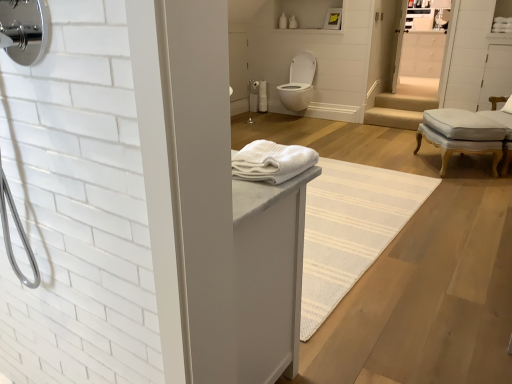
Question: Is matte white shower at center taller than light gray fabric ottoman at right?

Choices:
 (A) yes
 (B) no

Answer: (A)

Question: Can you confirm if matte white shower at center is wider than light gray fabric ottoman at right?

Choices:
 (A) no
 (B) yes

Answer: (A)

Question: From the image's perspective, is matte white shower at center on light gray fabric ottoman at right?

Choices:
 (A) no
 (B) yes

Answer: (B)

Question: Is matte white shower at center at the right side of light gray fabric ottoman at right?

Choices:
 (A) no
 (B) yes

Answer: (A)

Question: Considering the relative sizes of matte white shower at center and light gray fabric ottoman at right in the image provided, is matte white shower at center shorter than light gray fabric ottoman at right?

Choices:
 (A) yes
 (B) no

Answer: (B)

Question: Is matte white shower at center positioned behind light gray fabric ottoman at right?

Choices:
 (A) yes
 (B) no

Answer: (A)

Question: Does white matte cabinet at upper right lie in front of white glossy toilet at center?

Choices:
 (A) yes
 (B) no

Answer: (B)

Question: Does white matte cabinet at upper right have a greater width compared to white glossy toilet at center?

Choices:
 (A) no
 (B) yes

Answer: (B)

Question: Considering the relative sizes of white matte cabinet at upper right and white glossy toilet at center in the image provided, is white matte cabinet at upper right thinner than white glossy toilet at center?

Choices:
 (A) yes
 (B) no

Answer: (B)

Question: Does white matte cabinet at upper right have a greater height compared to white glossy toilet at center?

Choices:
 (A) no
 (B) yes

Answer: (B)

Question: Considering the relative positions of white matte cabinet at upper right and white glossy toilet at center in the image provided, is white matte cabinet at upper right behind white glossy toilet at center?

Choices:
 (A) yes
 (B) no

Answer: (A)

Question: Is white matte cabinet at upper right turned away from white glossy toilet at center?

Choices:
 (A) yes
 (B) no

Answer: (B)

Question: Considering the relative sizes of white glossy toilet at center and white soft towel at center in the image provided, is white glossy toilet at center wider than white soft towel at center?

Choices:
 (A) yes
 (B) no

Answer: (A)